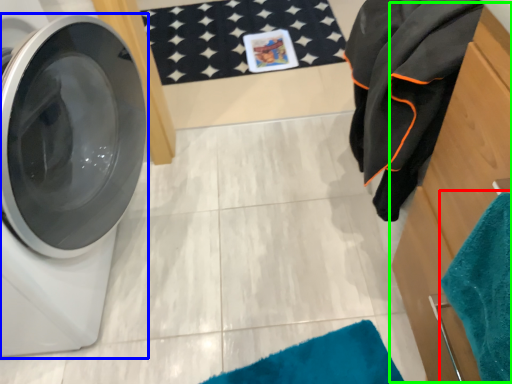
Question: Considering the real-world distances, which object is closest to beach towel (highlighted by a red box)? washing machine (highlighted by a blue box) or dresser (highlighted by a green box).

Choices:
 (A) washing machine
 (B) dresser

Answer: (B)